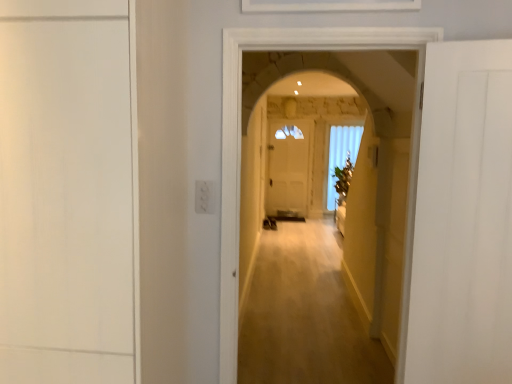
Find the location of `blank space situated above white matte door at right, acting as the 1th door starting from the right (from a real-world perspective)`. blank space situated above white matte door at right, acting as the 1th door starting from the right (from a real-world perspective) is located at coordinates (466, 41).